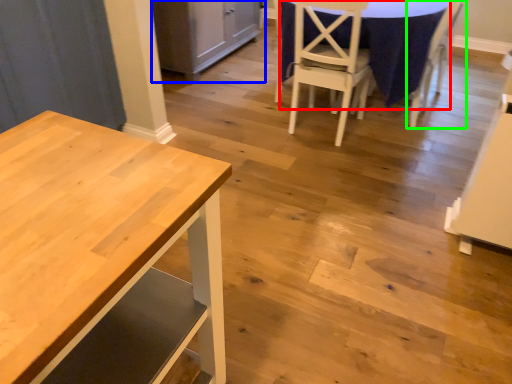
Question: Which object is the closest to the tablecloth (highlighted by a red box)? Choose among these: cabinetry (highlighted by a blue box) or chair (highlighted by a green box).

Choices:
 (A) cabinetry
 (B) chair

Answer: (B)